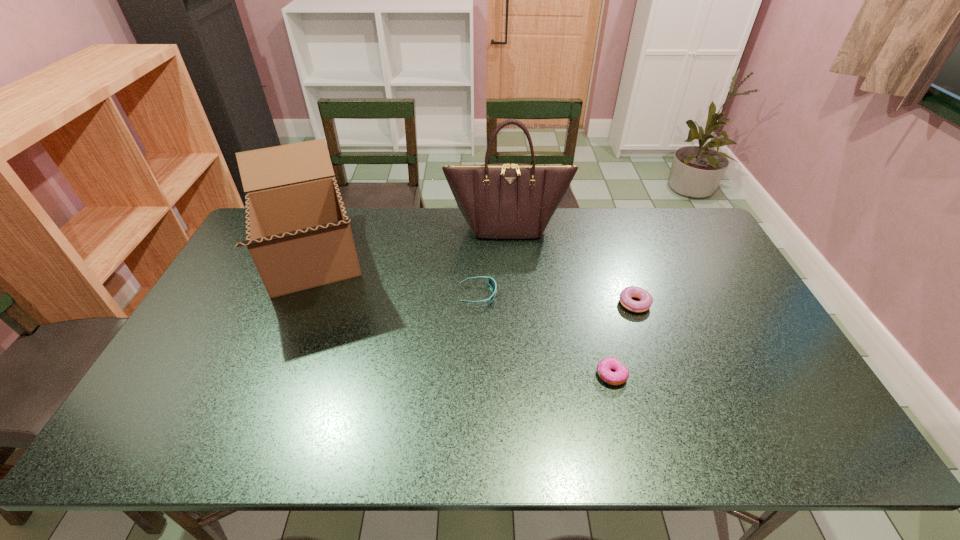
Find the location of a particular element. The width and height of the screenshot is (960, 540). vacant space located 0.220m on the front-facing side of the sunglasses is located at coordinates (569, 295).

Locate an element on the screen. vacant position located 0.290m on the right of the right doughnut is located at coordinates (748, 305).

Where is `free location located 0.340m on the right of the nearest object`? free location located 0.340m on the right of the nearest object is located at coordinates (760, 375).

I want to click on handbag positioned at the far edge, so click(505, 200).

Locate an element on the screen. box that is at the far edge is located at coordinates (298, 233).

Find the location of a particular element. This screenshot has width=960, height=540. object present at the left edge is located at coordinates (298, 233).

Locate an element on the screen. The image size is (960, 540). object at the far left corner is located at coordinates (298, 233).

Identify the location of free space at the far edge. The height and width of the screenshot is (540, 960). (420, 221).

Locate an element on the screen. Image resolution: width=960 pixels, height=540 pixels. vacant area at the near edge is located at coordinates (678, 423).

Where is `free space at the left edge`? free space at the left edge is located at coordinates (219, 354).